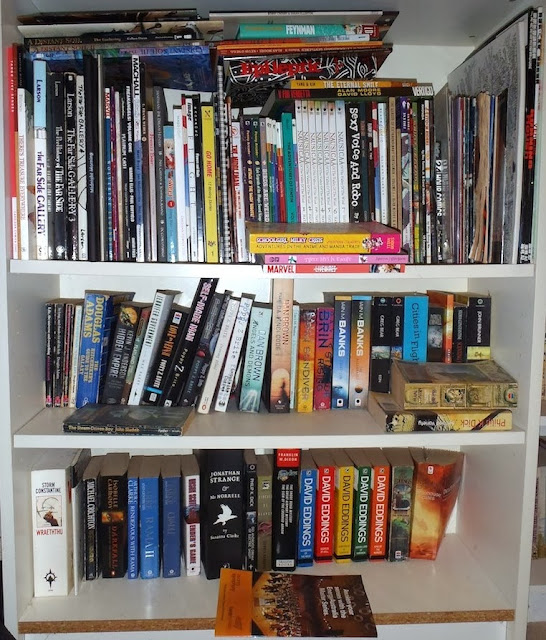
Locate an element on the screen. shelf is located at coordinates (430, 276), (391, 442), (427, 612), (543, 424), (538, 584).